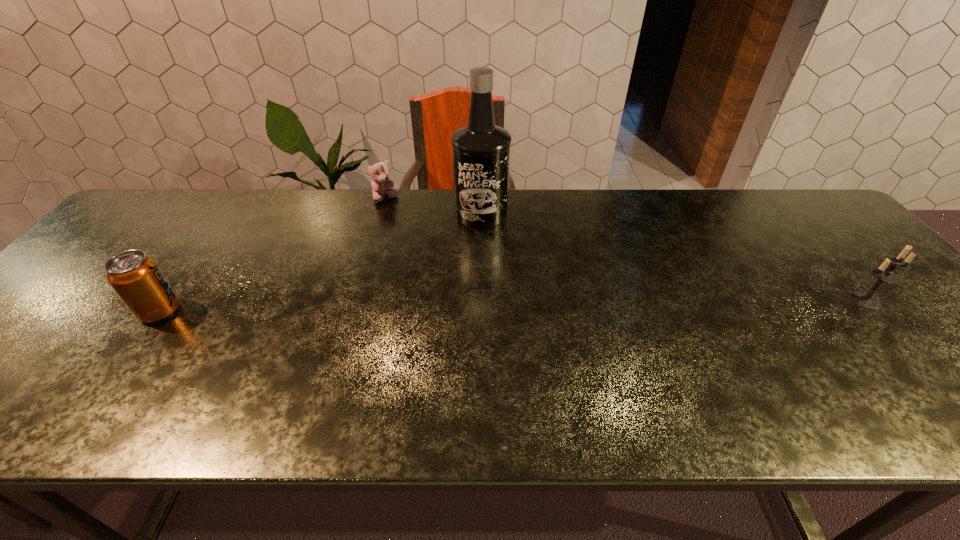
Locate an element on the screen. The height and width of the screenshot is (540, 960). the leftmost object is located at coordinates (136, 278).

The height and width of the screenshot is (540, 960). I want to click on the rightmost object, so click(884, 274).

This screenshot has height=540, width=960. Identify the location of the second object from right to left. (481, 150).

Where is `liquor`? The width and height of the screenshot is (960, 540). liquor is located at coordinates pos(481,150).

Where is `the third object from right to left`? The height and width of the screenshot is (540, 960). the third object from right to left is located at coordinates (382, 186).

I want to click on teddy bear, so click(x=382, y=186).

You are a GUI agent. You are given a task and a screenshot of the screen. Output one action in this format:
    pyautogui.click(x=<x>, y=<y>)
    Task: Click on the blank space located on the right of the leftmost object
    
    Given the screenshot: What is the action you would take?
    pyautogui.click(x=247, y=310)

Where is `vacant area situated on the left of the rightmost object`? vacant area situated on the left of the rightmost object is located at coordinates (758, 300).

This screenshot has height=540, width=960. I want to click on blank space located on the front label of the liquor, so click(x=488, y=281).

Where is `vacant space located 0.090m on the front label of the liquor`? This screenshot has height=540, width=960. vacant space located 0.090m on the front label of the liquor is located at coordinates (485, 249).